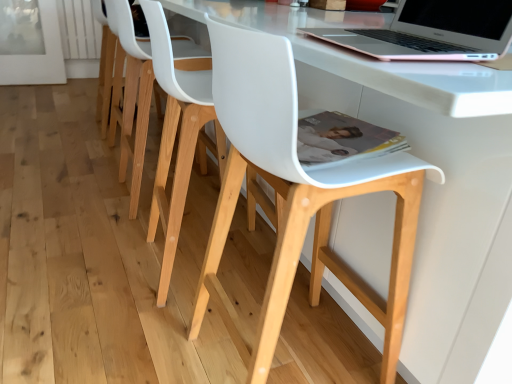
Question: From a real-world perspective, is white matte plastic chair at center, which appears as the second chair when viewed from the front, physically located above or below white matte chair at center, acting as the third chair starting from the back?

Choices:
 (A) below
 (B) above

Answer: (B)

Question: Considering the positions of white matte plastic chair at center, which appears as the second chair when viewed from the front, and white matte chair at center, which is counted as the first chair, starting from the front, in the image, is white matte plastic chair at center, which appears as the second chair when viewed from the front, taller or shorter than white matte chair at center, which is counted as the first chair, starting from the front,?

Choices:
 (A) short
 (B) tall

Answer: (B)

Question: Which of these objects is positioned farthest from the white matte chair at center, the first chair from the back?

Choices:
 (A) white matte chair at center, acting as the third chair starting from the back
 (B) rose gold aluminum laptop at upper right
 (C) white matte plastic chair at center, which appears as the second chair when viewed from the front

Answer: (B)

Question: Estimate the real-world distances between objects in this image. Which object is farther from the rose gold aluminum laptop at upper right?

Choices:
 (A) white matte chair at center, which ranks as the third chair in front-to-back order
 (B) white matte chair at center, acting as the third chair starting from the back
 (C) white matte plastic chair at center, positioned as the second chair in back-to-front order

Answer: (A)